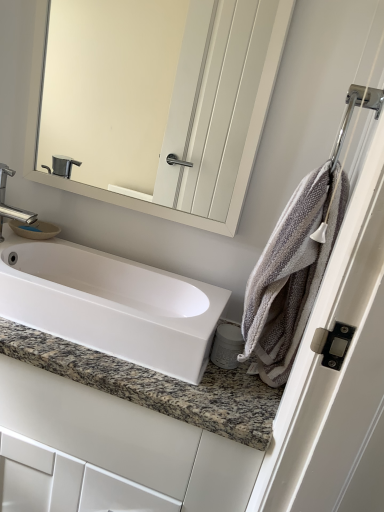
In order to face matte white mirror at upper center, should I rotate leftwards or rightwards?

A 6.932 degree turn to the left will do.

Describe the element at coordinates (143, 201) in the screenshot. I see `matte white mirror at upper center` at that location.

I want to click on silver metallic faucet at left, so click(x=10, y=206).

Based on the photo, from the image's perspective, which object appears higher, chrome metallic towel bar at upper right or white glossy sink at center?

chrome metallic towel bar at upper right is shown above in the image.

Who is bigger, chrome metallic towel bar at upper right or white glossy sink at center?

white glossy sink at center.

Is chrome metallic towel bar at upper right far from white glossy sink at center?

Actually, chrome metallic towel bar at upper right and white glossy sink at center are a little close together.

Does chrome metallic towel bar at upper right have a lesser width compared to white glossy sink at center?

Yes, chrome metallic towel bar at upper right is thinner than white glossy sink at center.

Considering the sizes of objects matte white mirror at upper center and silver metallic faucet at left in the image provided, who is shorter, matte white mirror at upper center or silver metallic faucet at left?

With less height is silver metallic faucet at left.

Is matte white mirror at upper center oriented away from silver metallic faucet at left?

That's not correct — matte white mirror at upper center is not looking away from silver metallic faucet at left.

Which object is thinner, matte white mirror at upper center or silver metallic faucet at left?

With smaller width is matte white mirror at upper center.

From a real-world perspective, who is located lower, matte white mirror at upper center or silver metallic faucet at left?

In real-world perspective, silver metallic faucet at left is lower.

Considering the positions of objects white glossy cabinet at center and chrome metallic towel bar at upper right in the image provided, who is more to the right, white glossy cabinet at center or chrome metallic towel bar at upper right?

chrome metallic towel bar at upper right is more to the right.

Is white glossy cabinet at center positioned far away from chrome metallic towel bar at upper right?

white glossy cabinet at center is near chrome metallic towel bar at upper right, not far away.

Is white glossy cabinet at center further to the viewer compared to chrome metallic towel bar at upper right?

Yes, white glossy cabinet at center is further from the viewer.

In terms of size, does white glossy cabinet at center appear bigger or smaller than chrome metallic towel bar at upper right?

Clearly, white glossy cabinet at center is larger in size than chrome metallic towel bar at upper right.

Between chrome metallic towel bar at upper right and gray textured towel at right, which one has smaller width?

Thinner between the two is chrome metallic towel bar at upper right.

How much distance is there between chrome metallic towel bar at upper right and gray textured towel at right?

A distance of 7.56 inches exists between chrome metallic towel bar at upper right and gray textured towel at right.

From a real-world perspective, does chrome metallic towel bar at upper right stand above gray textured towel at right?

Yes, from a real-world perspective, chrome metallic towel bar at upper right is over gray textured towel at right

Do you think silver metallic faucet at left is within matte white mirror at upper center, or outside of it?

silver metallic faucet at left lies outside matte white mirror at upper center.

Looking at this image, from a real-world perspective, is silver metallic faucet at left above or below matte white mirror at upper center?

silver metallic faucet at left is situated lower than matte white mirror at upper center in the real world.

Which of these two, silver metallic faucet at left or matte white mirror at upper center, is wider?

Wider between the two is silver metallic faucet at left.

From the image's perspective, is silver metallic faucet at left on matte white mirror at upper center?

No, from the image's perspective, silver metallic faucet at left is not above matte white mirror at upper center.

Can you confirm if white glossy sink at center is thinner than white glossy cabinet at center?

Correct, the width of white glossy sink at center is less than that of white glossy cabinet at center.

Is white glossy sink at center oriented towards white glossy cabinet at center?

No, white glossy sink at center is not oriented towards white glossy cabinet at center.

How different are the orientations of white glossy sink at center and white glossy cabinet at center in degrees?

The angular difference between white glossy sink at center and white glossy cabinet at center is 0.000318 degrees.

Considering the sizes of white glossy sink at center and white glossy cabinet at center in the image, is white glossy sink at center bigger or smaller than white glossy cabinet at center?

Considering their sizes, white glossy sink at center takes up less space than white glossy cabinet at center.

Does chrome metallic towel bar at upper right have a greater height compared to white glossy cabinet at center?

No, chrome metallic towel bar at upper right is not taller than white glossy cabinet at center.

Locate an element on the screen. This screenshot has height=512, width=384. shower to the right of white glossy cabinet at center is located at coordinates (352, 113).

Is white glossy cabinet at center at the back of chrome metallic towel bar at upper right?

No.

Between chrome metallic towel bar at upper right and white glossy cabinet at center, which one has smaller size?

With smaller size is chrome metallic towel bar at upper right.

At what (x,y) coordinates should I click in order to perform the action: click on shower on the right of white glossy sink at center. Please return your answer as a coordinate pair (x, y). The width and height of the screenshot is (384, 512). Looking at the image, I should click on (352, 113).

In order to click on mirror above the silver metallic faucet at left (from a real-world perspective) in this screenshot , I will do `click(143, 201)`.

Looking at this image, based on their spatial positions, is white glossy cabinet at center or white glossy sink at center further from silver metallic faucet at left?

white glossy cabinet at center.

From the image, which object appears to be nearer to chrome metallic towel bar at upper right, white glossy cabinet at center or white glossy sink at center?

white glossy sink at center.

Looking at this image, based on their spatial positions, is matte white mirror at upper center or gray textured towel at right further from white glossy sink at center?

gray textured towel at right.

Estimate the real-world distances between objects in this image. Which object is further from matte white mirror at upper center, white glossy sink at center or silver metallic faucet at left?

silver metallic faucet at left lies further to matte white mirror at upper center than the other object.

Considering their positions, is matte white mirror at upper center positioned further to white glossy sink at center than silver metallic faucet at left?

silver metallic faucet at left is further to white glossy sink at center.

Looking at the image, which one is located further to chrome metallic towel bar at upper right, white glossy sink at center or silver metallic faucet at left?

The object further to chrome metallic towel bar at upper right is silver metallic faucet at left.

When comparing their distances from matte white mirror at upper center, does chrome metallic towel bar at upper right or gray textured towel at right seem further?

chrome metallic towel bar at upper right is positioned further to the anchor matte white mirror at upper center.

Which object lies nearer to the anchor point matte white mirror at upper center, gray textured towel at right or silver metallic faucet at left?

gray textured towel at right.

Locate an element on the screen. mirror located between silver metallic faucet at left and chrome metallic towel bar at upper right in the left-right direction is located at coordinates (143, 201).

Identify the location of shower between matte white mirror at upper center and white glossy cabinet at center in the vertical direction. (352, 113).

Where is `bath towel located between matte white mirror at upper center and chrome metallic towel bar at upper right in the left-right direction`? bath towel located between matte white mirror at upper center and chrome metallic towel bar at upper right in the left-right direction is located at coordinates (291, 274).

Identify the location of bath towel between white glossy sink at center and chrome metallic towel bar at upper right. This screenshot has height=512, width=384. (291, 274).